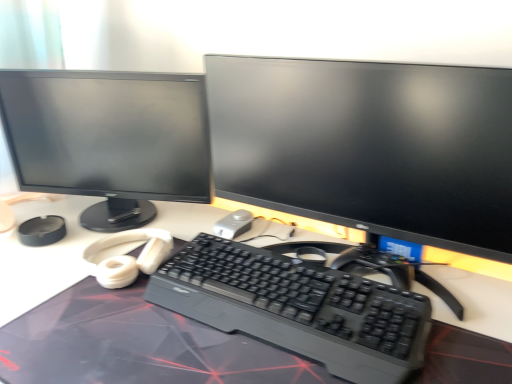
Question: Is matte black monitor at center, which is the 1th computer monitor in right-to-left order, wider than satin silver mouse at center?

Choices:
 (A) no
 (B) yes

Answer: (B)

Question: Can you confirm if matte black monitor at center, which is the 1th computer monitor in right-to-left order, is smaller than satin silver mouse at center?

Choices:
 (A) yes
 (B) no

Answer: (B)

Question: From the image's perspective, is matte black monitor at center, which is the 1th computer monitor in right-to-left order, located above satin silver mouse at center?

Choices:
 (A) yes
 (B) no

Answer: (A)

Question: Can you confirm if matte black monitor at center, the 2th computer monitor when ordered from left to right, is taller than satin silver mouse at center?

Choices:
 (A) yes
 (B) no

Answer: (A)

Question: From the image's perspective, is matte black monitor at center, the 2th computer monitor when ordered from left to right, under satin silver mouse at center?

Choices:
 (A) yes
 (B) no

Answer: (B)

Question: Is matte black monitor at center, the 2th computer monitor when ordered from left to right, far from satin silver mouse at center?

Choices:
 (A) yes
 (B) no

Answer: (B)

Question: Could you tell me if matte black monitor at left, which is counted as the second computer monitor, starting from the right, is turned towards black plastic keyboard at center?

Choices:
 (A) no
 (B) yes

Answer: (A)

Question: Considering the relative positions of matte black monitor at left, arranged as the first computer monitor when viewed from the left, and black plastic keyboard at center in the image provided, is matte black monitor at left, arranged as the first computer monitor when viewed from the left, to the left of black plastic keyboard at center from the viewer's perspective?

Choices:
 (A) yes
 (B) no

Answer: (A)

Question: Can you confirm if matte black monitor at left, arranged as the first computer monitor when viewed from the left, is smaller than black plastic keyboard at center?

Choices:
 (A) no
 (B) yes

Answer: (A)

Question: Considering the relative positions of matte black monitor at left, arranged as the first computer monitor when viewed from the left, and black plastic keyboard at center in the image provided, is matte black monitor at left, arranged as the first computer monitor when viewed from the left, to the right of black plastic keyboard at center from the viewer's perspective?

Choices:
 (A) no
 (B) yes

Answer: (A)

Question: From a real-world perspective, is matte black monitor at left, which is counted as the second computer monitor, starting from the right, under black plastic keyboard at center?

Choices:
 (A) yes
 (B) no

Answer: (B)

Question: Is black plastic keyboard at center at the back of matte black monitor at left, which is counted as the second computer monitor, starting from the right?

Choices:
 (A) yes
 (B) no

Answer: (B)

Question: Does matte black monitor at left, which is counted as the second computer monitor, starting from the right, have a lesser width compared to satin silver mouse at center?

Choices:
 (A) no
 (B) yes

Answer: (A)